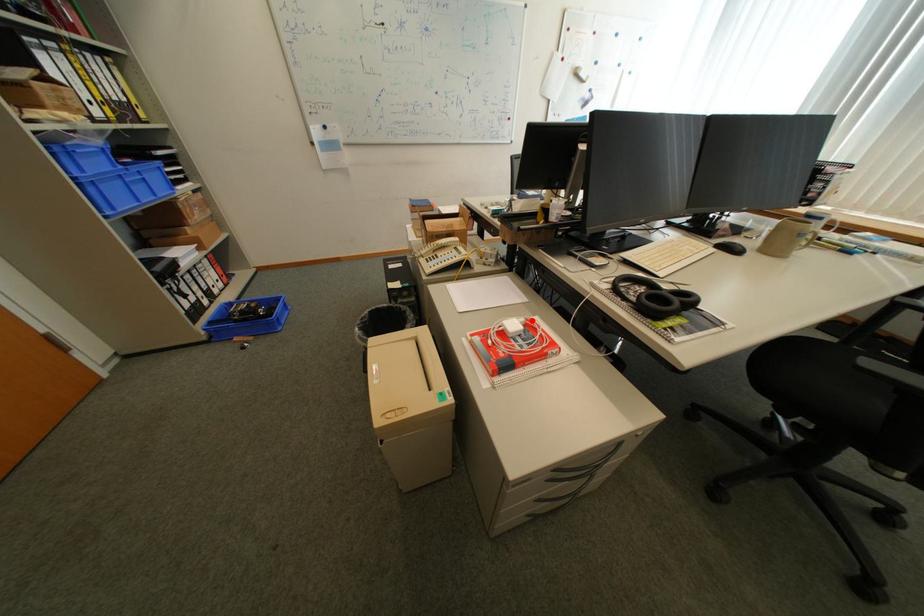
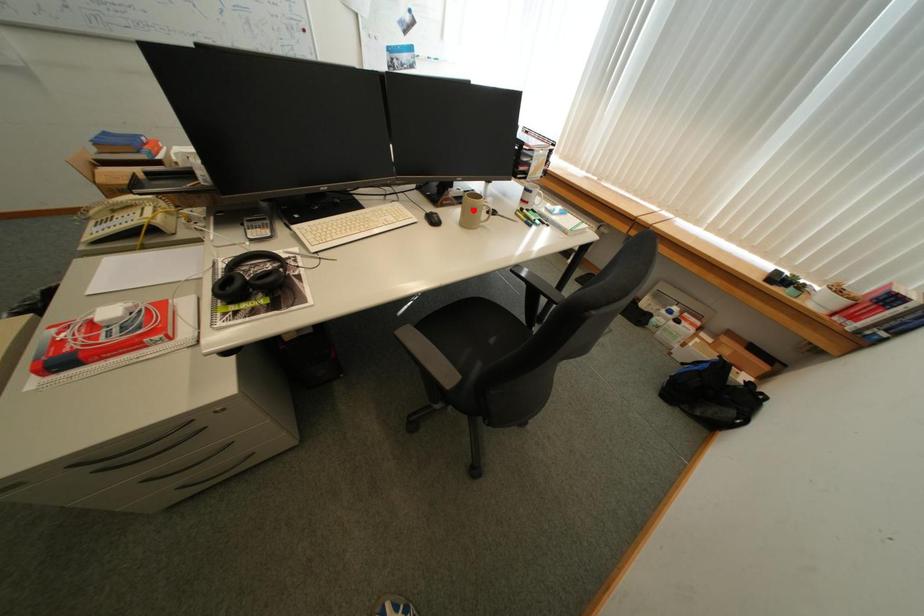
I am providing you with two images of the same scene from different viewpoints. A red point is marked on the first image and another point is marked on the second image. Does the point marked in image1 correspond to the same location as the one in image2?

No